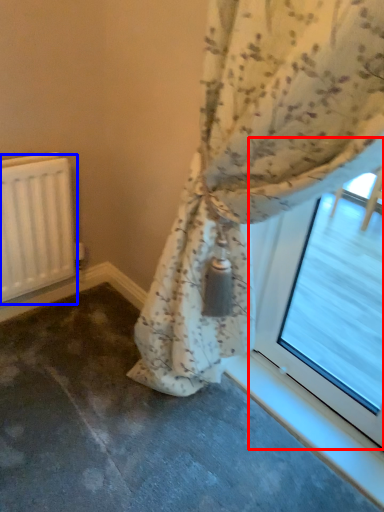
Question: Which object is further to the camera taking this photo, bay window (highlighted by a red box) or radiator (highlighted by a blue box)?

Choices:
 (A) bay window
 (B) radiator

Answer: (B)